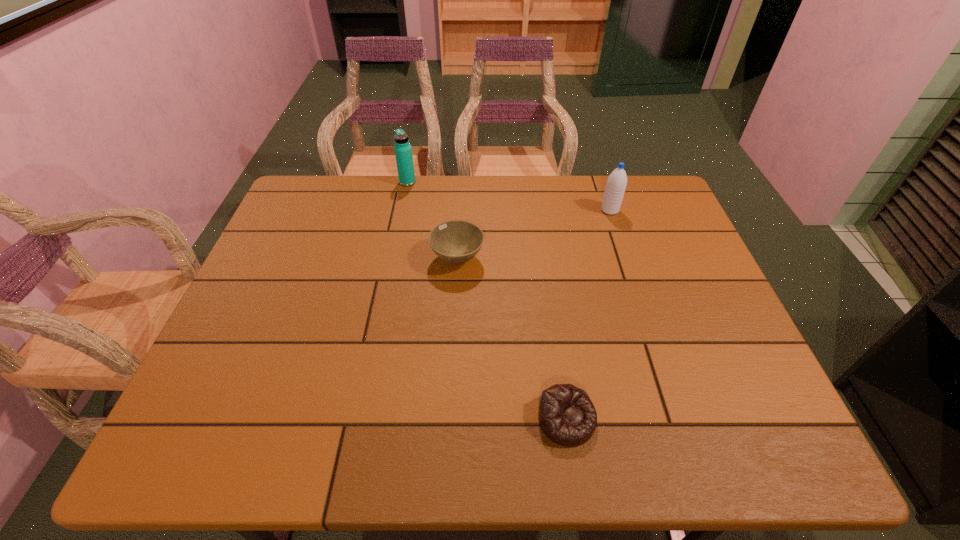
At what (x,y) coordinates should I click in order to perform the action: click on blank space located 0.160m on the back of the second nearest object. Please return your answer as a coordinate pair (x, y). The height and width of the screenshot is (540, 960). Looking at the image, I should click on (460, 207).

At what (x,y) coordinates should I click in order to perform the action: click on free location located on the back of the shortest object. Please return your answer as a coordinate pair (x, y). Looking at the image, I should click on (560, 368).

Find the location of a particular element. This screenshot has height=540, width=960. object situated at the near edge is located at coordinates (567, 416).

In the image, there is a desktop. Identify the location of vacant space at the far edge. (483, 194).

The width and height of the screenshot is (960, 540). Identify the location of free point at the near edge. (511, 426).

In the image, there is a desktop. Where is `vacant space at the left edge`? The image size is (960, 540). vacant space at the left edge is located at coordinates (252, 328).

Find the location of a particular element. vacant space at the right edge is located at coordinates [680, 253].

In the image, there is a desktop. Where is `vacant space at the far left corner`? vacant space at the far left corner is located at coordinates (338, 197).

In the image, there is a desktop. Identify the location of vacant space at the near left corner. This screenshot has height=540, width=960. point(206,428).

Where is `empty space that is in between the third nearest object and the shortest object`? This screenshot has width=960, height=540. empty space that is in between the third nearest object and the shortest object is located at coordinates (588, 315).